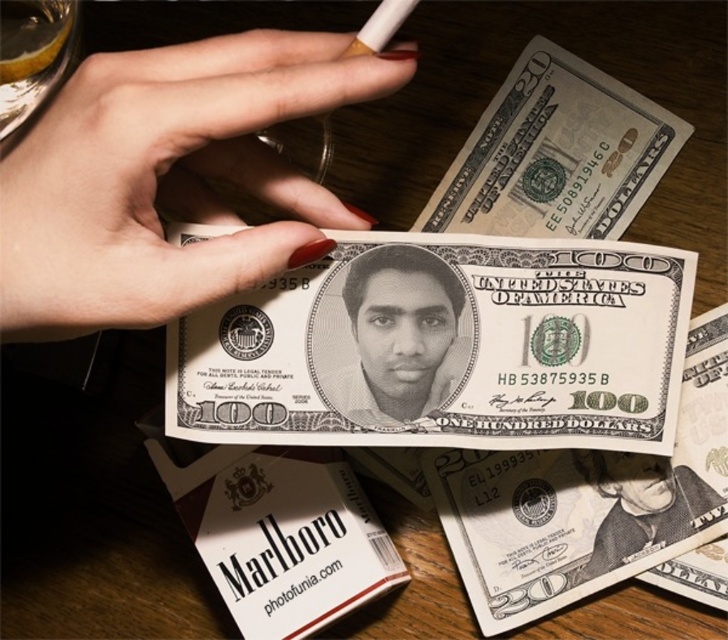
Question: Which object is the closest to the nail polish at center?

Choices:
 (A) green paper currency at upper right
 (B) white paper currency at center

Answer: (B)

Question: Is nail polish at center below black matte portrait at center?

Choices:
 (A) no
 (B) yes

Answer: (A)

Question: Can you confirm if nail polish at center is positioned to the right of green paper currency at upper right?

Choices:
 (A) yes
 (B) no

Answer: (B)

Question: Which of the following is the closest to the observer?

Choices:
 (A) (237, 323)
 (B) (577, 582)
 (C) (91, 134)
 (D) (389, 301)

Answer: (C)

Question: Among these points, which one is nearest to the camera?

Choices:
 (A) (415, 266)
 (B) (549, 156)

Answer: (A)

Question: From the image, what is the correct spatial relationship of white paper currency at center in relation to green paper currency at upper right?

Choices:
 (A) left
 (B) right

Answer: (A)